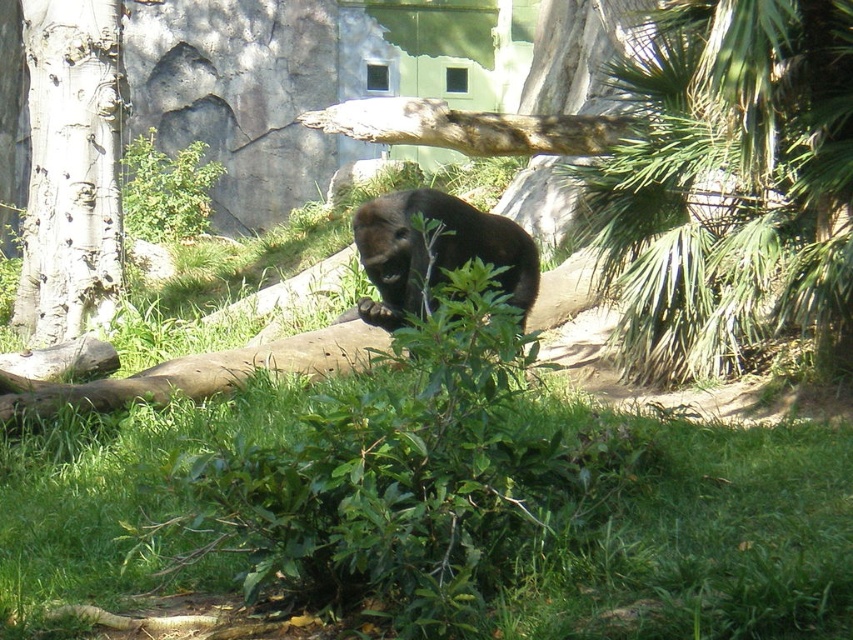
Question: Based on their relative distances, which object is nearer to the green leafy bush at center?

Choices:
 (A) smooth gray bark at left
 (B) brown furry bear at center
 (C) green leafy bush at upper left
 (D) green leafy tree at upper right

Answer: (B)

Question: Is green leafy tree at upper right behind smooth gray bark at left?

Choices:
 (A) no
 (B) yes

Answer: (A)

Question: Is brown furry bear at center to the left of green leafy bush at upper left from the viewer's perspective?

Choices:
 (A) no
 (B) yes

Answer: (A)

Question: Is green leafy bush at center to the left of green leafy tree at upper right from the viewer's perspective?

Choices:
 (A) no
 (B) yes

Answer: (B)

Question: Which object appears farthest from the camera in this image?

Choices:
 (A) smooth gray bark at left
 (B) brown furry bear at center
 (C) green leafy bush at center

Answer: (A)

Question: Estimate the real-world distances between objects in this image. Which object is closer to the green leafy bush at center?

Choices:
 (A) brown furry bear at center
 (B) green leafy tree at upper right

Answer: (A)